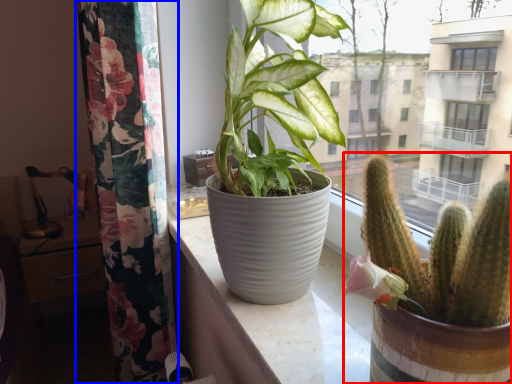
Question: Which object appears closest to the camera in this image, houseplant (highlighted by a red box) or curtain (highlighted by a blue box)?

Choices:
 (A) houseplant
 (B) curtain

Answer: (A)